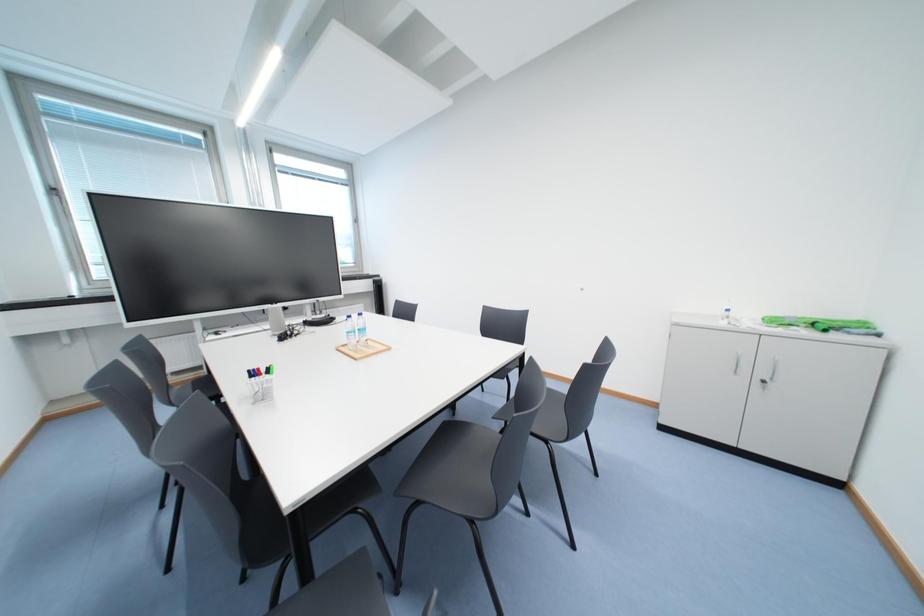
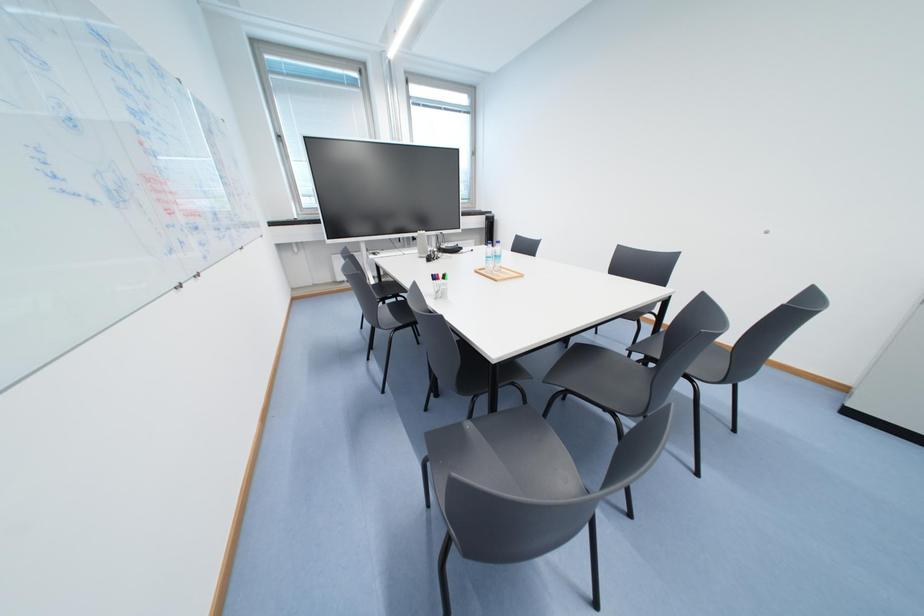
Which direction would the cameraman need to move to produce the second image?

The cameraman moved toward left, backward.